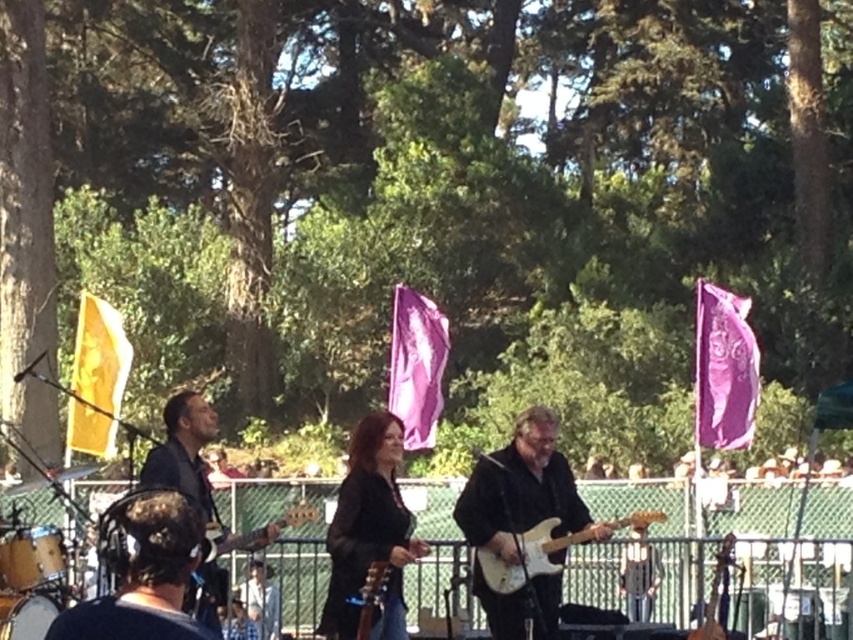
You are a photographer at the outdoor musical performance. You want to capture a photo of the purple fabric flag at right without any obstructions. Based on the scene description, where should you position yourself to ensure the flag is visible and unobstructed?

The purple fabric flag at right is located at point (x=724, y=369). To ensure it is visible and unobstructed, position yourself in a spot where this coordinate is not blocked by other objects in the scene, such as behind the performers or to the side where there are no people or instruments in the way.

You are a photographer standing at the back of the audience, and you want to take a photo of the white glossy electric guitar at center and the drummer on the left. How far apart are these two performers in the image?

The white glossy electric guitar at center and the drummer on the left are 20.12 meters apart.